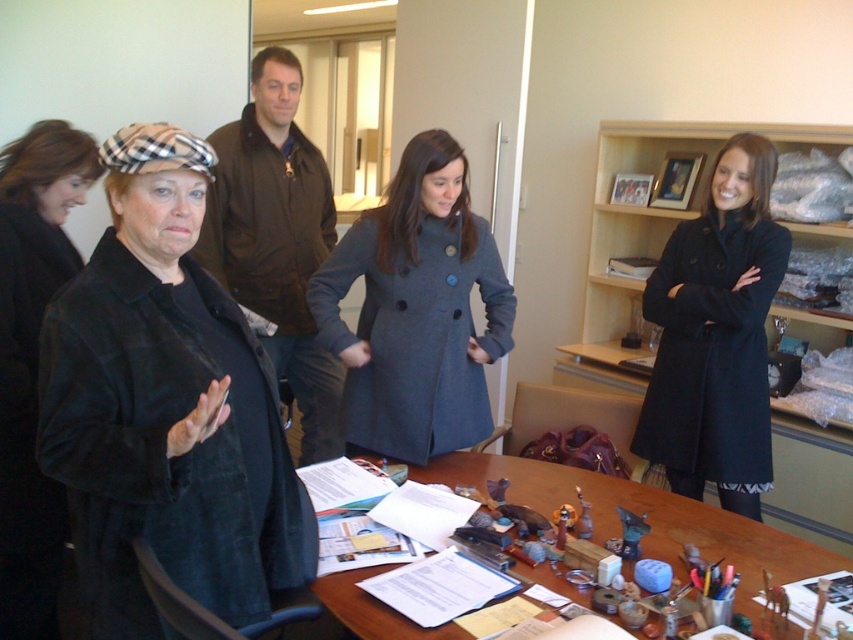
Question: From the image, what is the correct spatial relationship of black velvet coat at center in relation to wooden at center?

Choices:
 (A) above
 (B) below

Answer: (A)

Question: Which is farther from the black suede coat at left?

Choices:
 (A) gray wool coat at center
 (B) wooden bookshelf at upper center
 (C) black wool coat at right

Answer: (B)

Question: Which of the following is the closest to the observer?

Choices:
 (A) black velvet coat at center
 (B) brown leather jacket at upper center
 (C) wooden bookshelf at upper center

Answer: (A)

Question: Is black suede coat at left wider than wooden bookshelf at upper center?

Choices:
 (A) yes
 (B) no

Answer: (B)

Question: Considering the relative positions of black suede coat at left and gray wool coat at center in the image provided, where is black suede coat at left located with respect to gray wool coat at center?

Choices:
 (A) above
 (B) below

Answer: (B)

Question: Which point is farther to the camera?

Choices:
 (A) wooden at center
 (B) wooden bookshelf at upper center
 (C) brown leather jacket at upper center
 (D) gray wool coat at center

Answer: (B)